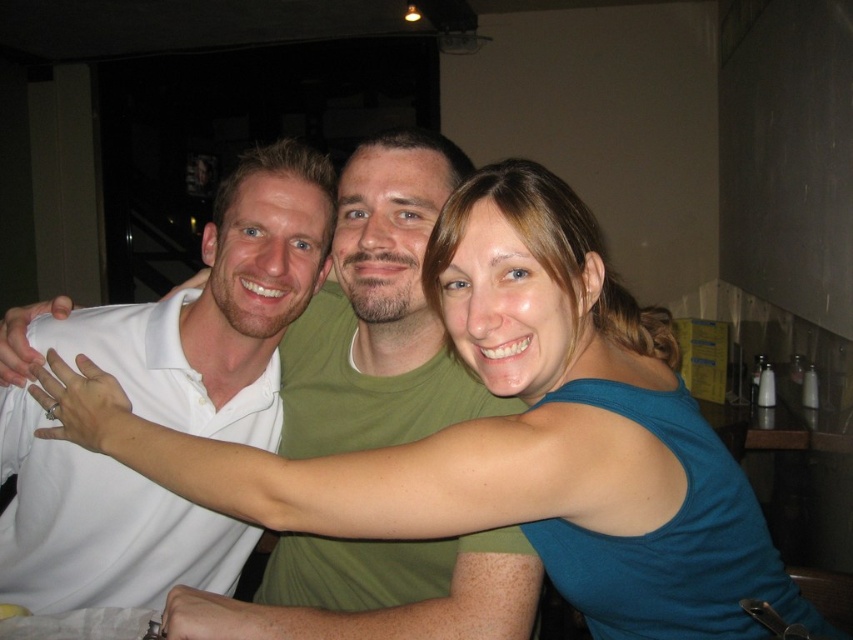
You are a photographer trying to capture a group photo of the three people in the scene. The blue fabric at center is part of the tablecloth. If you want to ensure all three individuals are in focus, what is the minimum distance you should set your camera lens to focus on?

The minimum focusing distance should be set to 31.40 inches to ensure all three individuals are in focus since they are 31.40 inches apart.

You are a photographer adjusting lighting for a group photo. You notice the blue fabric at center and the white matte shirt at left in your frame. Which object should you adjust the lighting to make taller in the photo?

The blue fabric at center is not as tall as the white matte shirt at left, so you should adjust the lighting to make the blue fabric at center taller in the photo.

You are a photographer adjusting the lighting in the scene. You need to place a spotlight on the blue fabric at center. Where should you aim the spotlight? Please provide coordinates in the format of point followed by numbers between 0 and 1, with 0,0 being the bottom left corner and 1,1 being the top right corner.

The blue fabric at center is located at point (492, 419), so you should aim the spotlight at that coordinate.